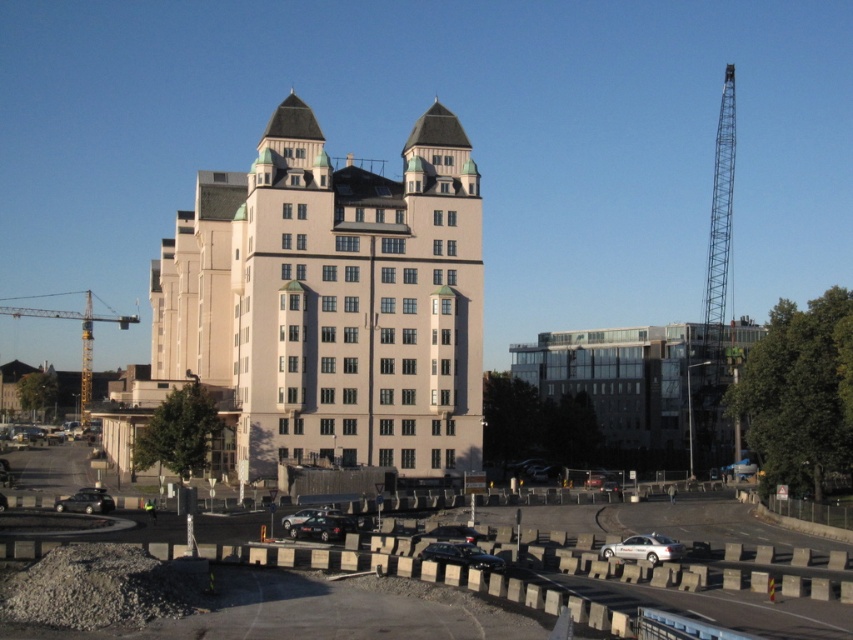
You are a pedestrian standing at the construction site entrance. You see the matte black car at lower left and the metallic silver sedan at center. Which car is closer to the entrance?

The matte black car at lower left is closer to the entrance because it is positioned to the left of the metallic silver sedan at center, which is further away from the entrance.

You are a delivery driver approaching the beige concrete building at center and the shiny black car at center. Which object will you encounter first?

The beige concrete building at center is closer to you than the shiny black car at center, so you will encounter the beige concrete building at center first.

You are standing at the construction site and want to know which of the two points, point (642, 554) or point (332, 525), is nearer to you. Based on the image, which point is closer?

Point (642, 554) is closer to the camera than point (332, 525), so it is the nearer point.